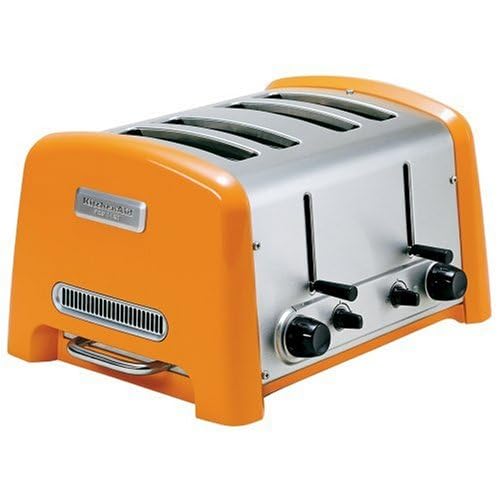
Where is `knob`? The height and width of the screenshot is (500, 500). knob is located at coordinates (305, 327).